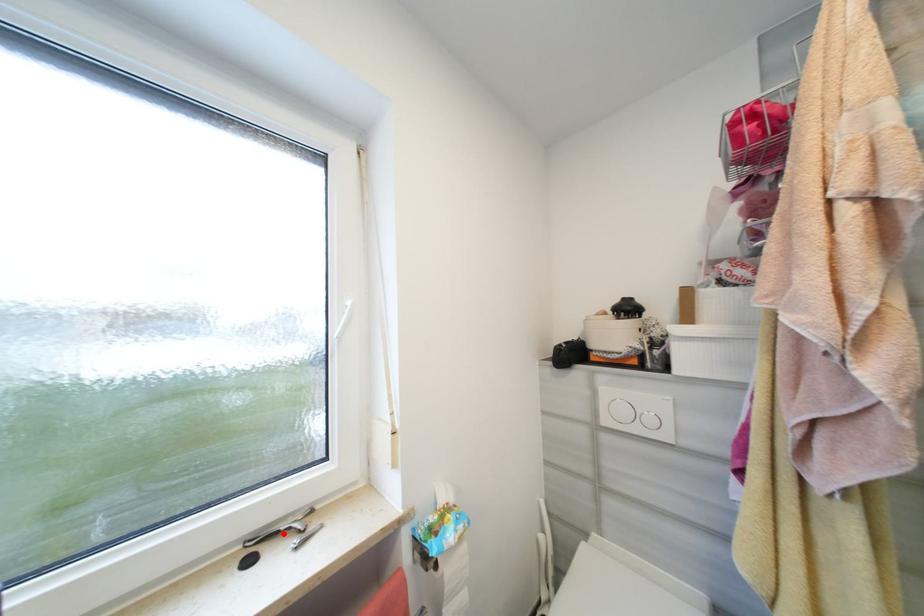
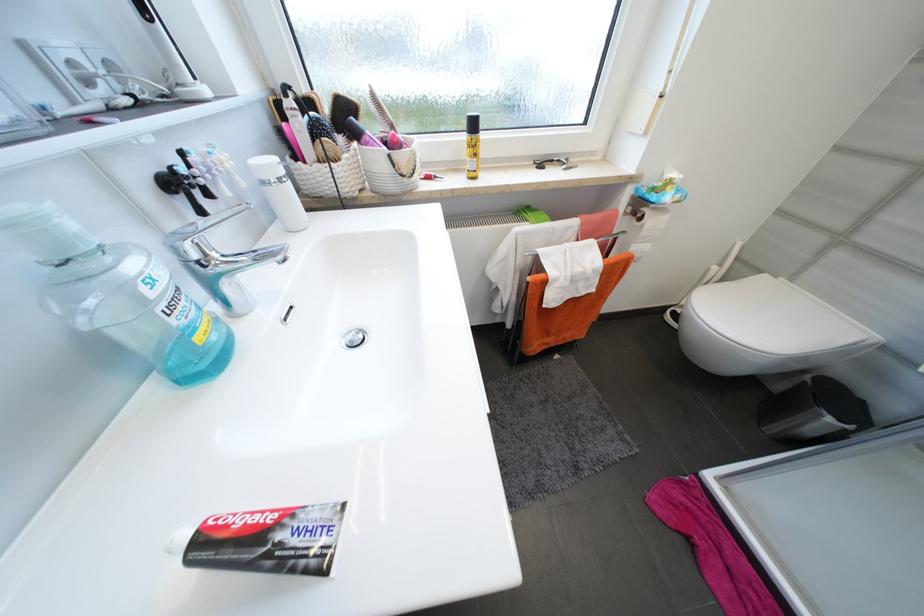
Locate, in the second image, the point that corresponds to the highlighted location in the first image.

(558, 161)